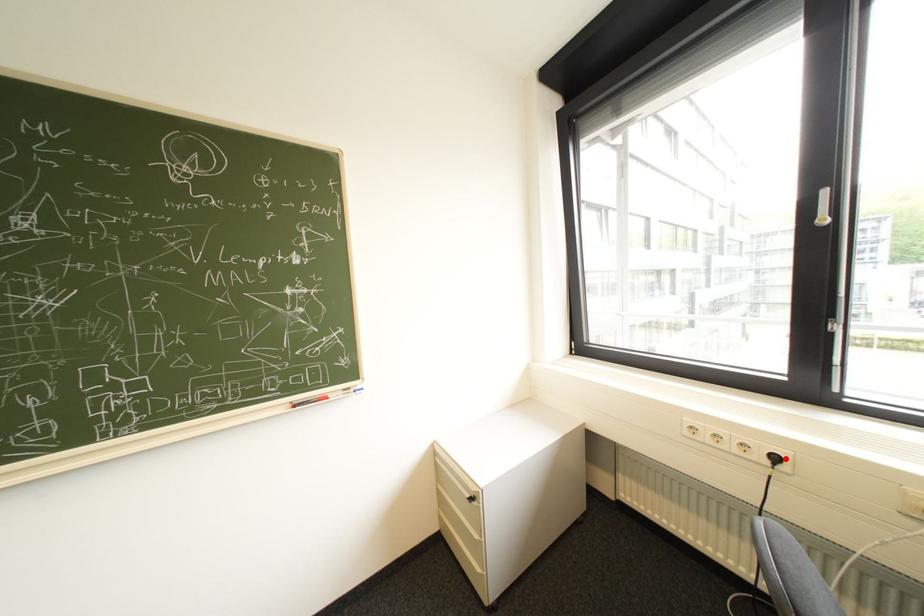
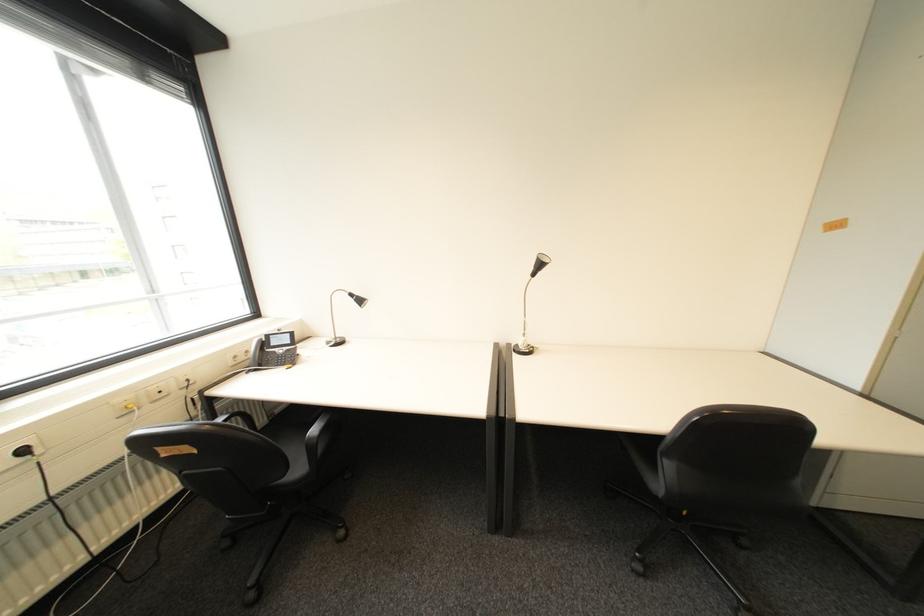
The point at the highlighted location is marked in the first image. Where is the corresponding point in the second image?

(34, 452)